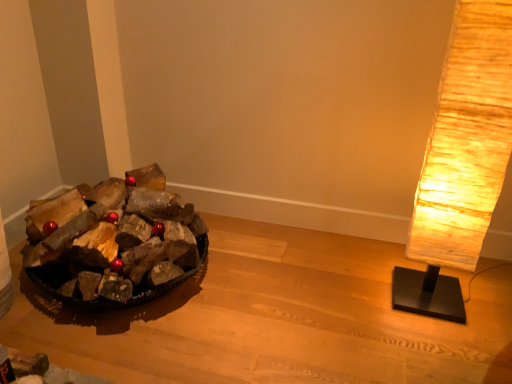
The image size is (512, 384). I want to click on free point above wooden logs at left (from a real-world perspective), so click(298, 300).